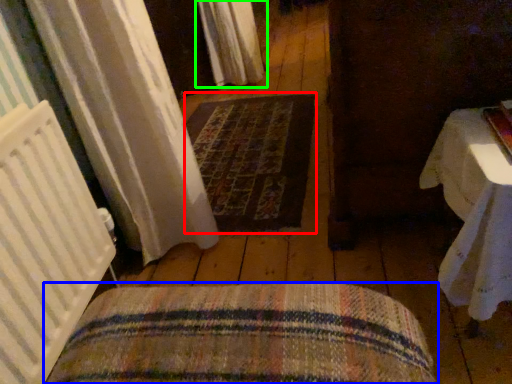
Question: Which is farther away from mat (highlighted by a red box)? furniture (highlighted by a blue box) or curtain (highlighted by a green box)?

Choices:
 (A) furniture
 (B) curtain

Answer: (A)